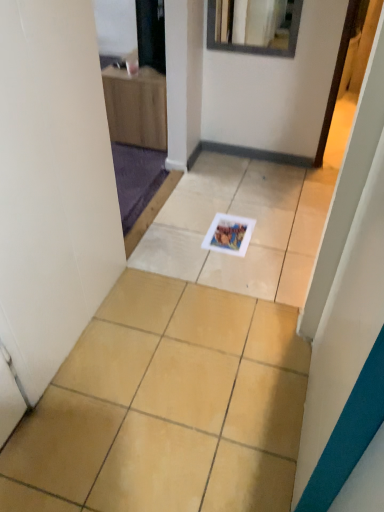
Question: Is white glossy magazine at center positioned with its back to beige ceramic tile at center?

Choices:
 (A) yes
 (B) no

Answer: (A)

Question: From a real-world perspective, does white glossy magazine at center stand above beige ceramic tile at center?

Choices:
 (A) no
 (B) yes

Answer: (B)

Question: Does white glossy magazine at center have a larger size compared to beige ceramic tile at center?

Choices:
 (A) no
 (B) yes

Answer: (A)

Question: Is white glossy magazine at center directly adjacent to beige ceramic tile at center?

Choices:
 (A) yes
 (B) no

Answer: (B)

Question: Considering the relative positions of white glossy magazine at center and beige ceramic tile at center in the image provided, is white glossy magazine at center to the left of beige ceramic tile at center from the viewer's perspective?

Choices:
 (A) no
 (B) yes

Answer: (A)

Question: Considering the relative positions of white glossy magazine at center and beige ceramic tile at center in the image provided, is white glossy magazine at center to the right of beige ceramic tile at center from the viewer's perspective?

Choices:
 (A) no
 (B) yes

Answer: (B)

Question: From a real-world perspective, is beige ceramic tile at center physically below white glossy magazine at center?

Choices:
 (A) yes
 (B) no

Answer: (A)

Question: Considering the relative positions of beige ceramic tile at center and white glossy magazine at center in the image provided, is beige ceramic tile at center to the left of white glossy magazine at center from the viewer's perspective?

Choices:
 (A) yes
 (B) no

Answer: (A)

Question: Is beige ceramic tile at center shorter than white glossy magazine at center?

Choices:
 (A) yes
 (B) no

Answer: (B)

Question: Is white glossy magazine at center located within beige ceramic tile at center?

Choices:
 (A) no
 (B) yes

Answer: (B)

Question: Considering the relative sizes of beige ceramic tile at center and white glossy magazine at center in the image provided, is beige ceramic tile at center thinner than white glossy magazine at center?

Choices:
 (A) no
 (B) yes

Answer: (A)

Question: Is beige ceramic tile at center at the right side of white glossy magazine at center?

Choices:
 (A) yes
 (B) no

Answer: (B)

Question: From the image's perspective, is beige ceramic tile at center positioned above or below white glossy magazine at center?

Choices:
 (A) below
 (B) above

Answer: (A)